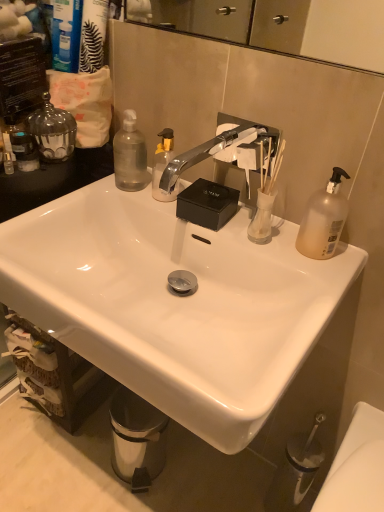
Identify the location of vacant space to the right of stainless steel trash can at lower left. Image resolution: width=384 pixels, height=512 pixels. (193, 473).